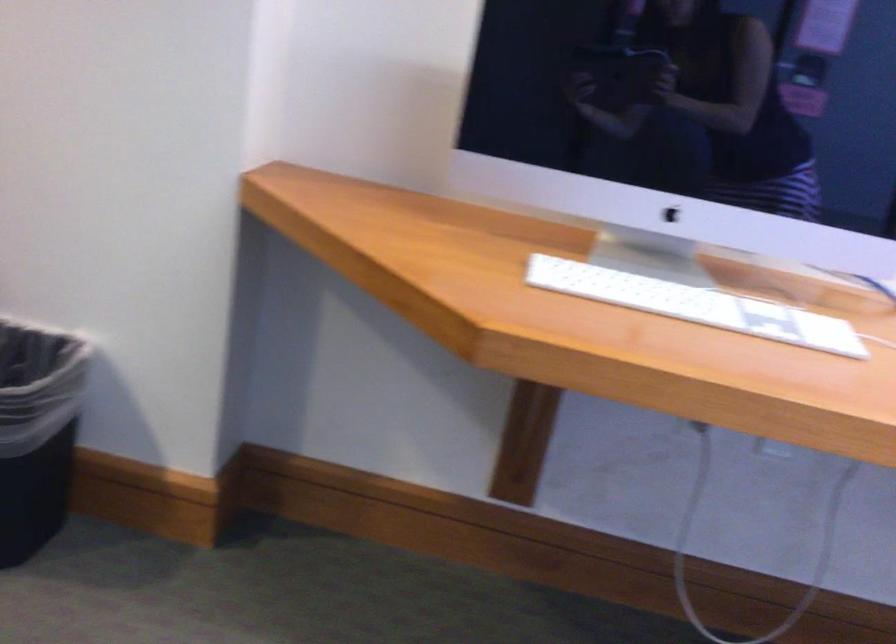
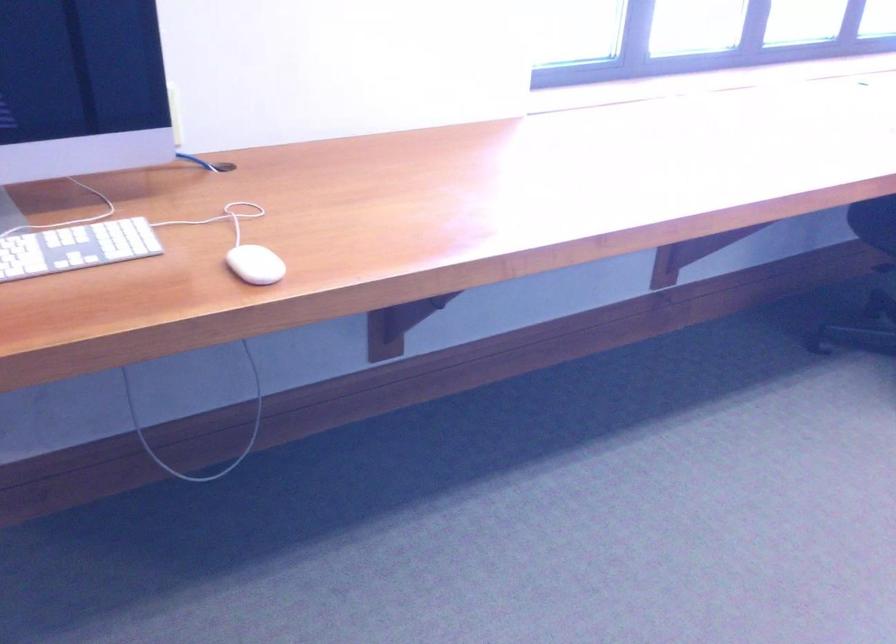
Where in the second image is the point corresponding to point 762,319 from the first image?

(75, 247)